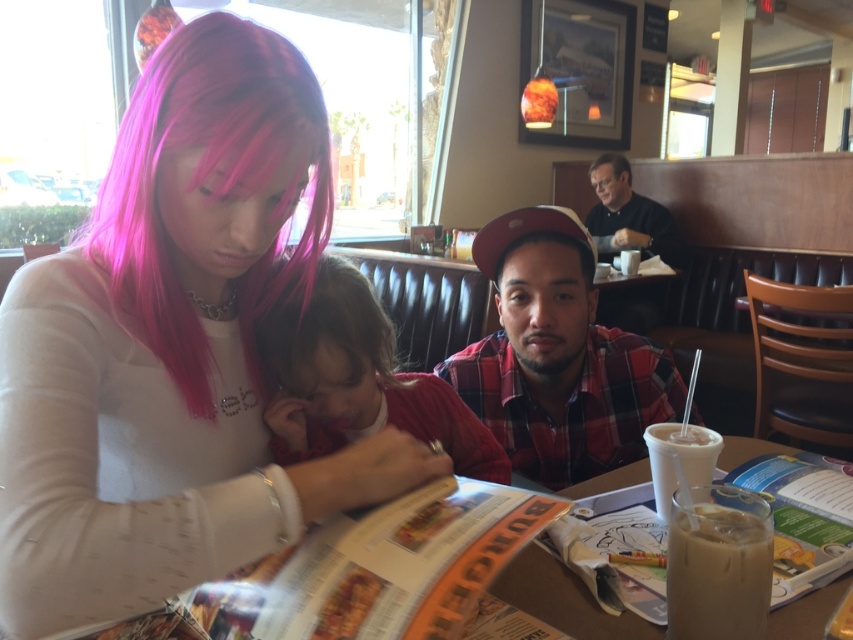
Question: Which of the following is the closest to the observer?

Choices:
 (A) (589, 625)
 (B) (616, 228)
 (C) (700, 433)
 (D) (337, 524)

Answer: (D)

Question: Does orange glossy magazine at center have a larger size compared to translucent plastic menu at center?

Choices:
 (A) yes
 (B) no

Answer: (B)

Question: Among these objects, which one is farthest from the camera?

Choices:
 (A) black matte shirt at upper right
 (B) plaid fabric shirt at center
 (C) white frosted cup at right

Answer: (A)

Question: Can you confirm if black matte shirt at upper right is positioned to the left of black matte cap at center?

Choices:
 (A) no
 (B) yes

Answer: (A)

Question: Can you confirm if translucent plastic menu at center is thinner than dark brown hair at upper right?

Choices:
 (A) yes
 (B) no

Answer: (B)

Question: Which object is closer to the camera taking this photo?

Choices:
 (A) orange glossy magazine at center
 (B) black matte cap at center

Answer: (A)